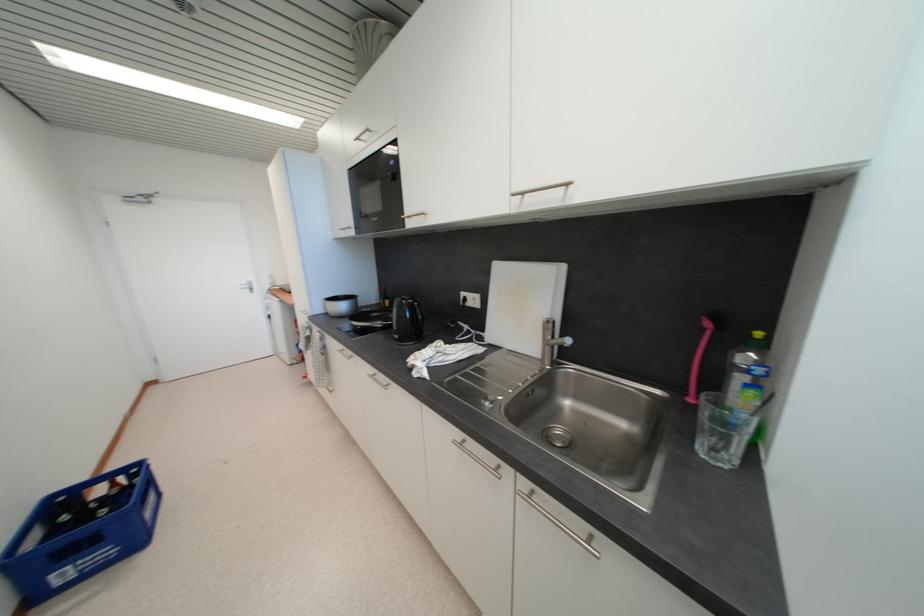
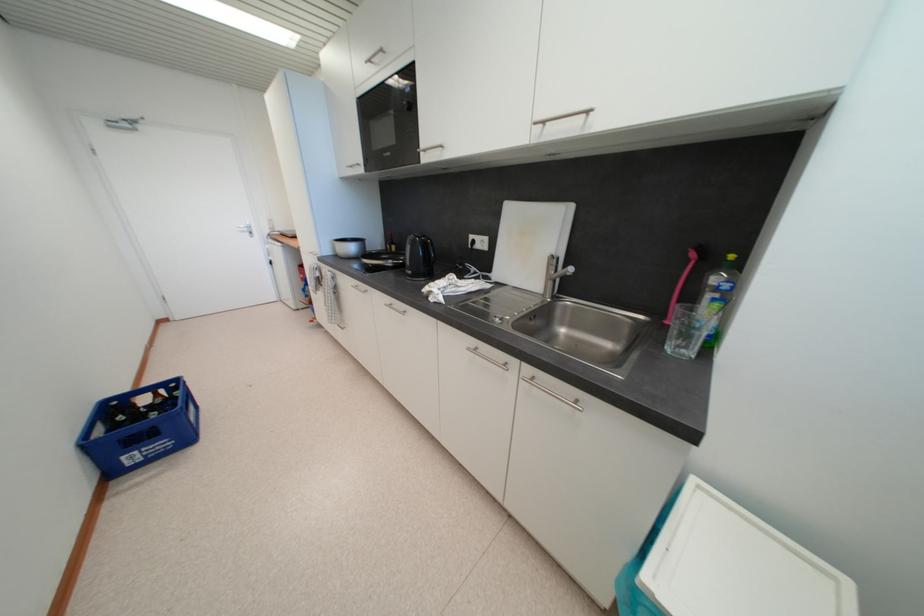
In the second image, find the point that corresponds to pixel 347 310 in the first image.

(357, 251)